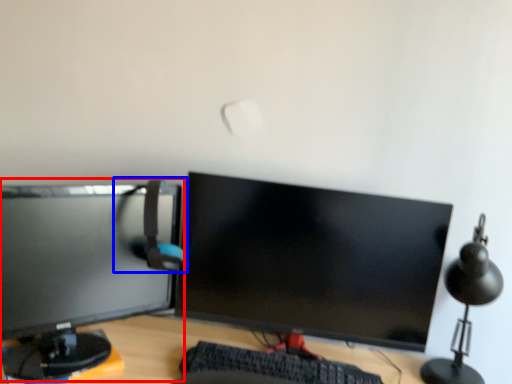
Question: Which object appears farthest to the camera in this image, computer monitor (highlighted by a red box) or computer chair (highlighted by a blue box)?

Choices:
 (A) computer monitor
 (B) computer chair

Answer: (B)